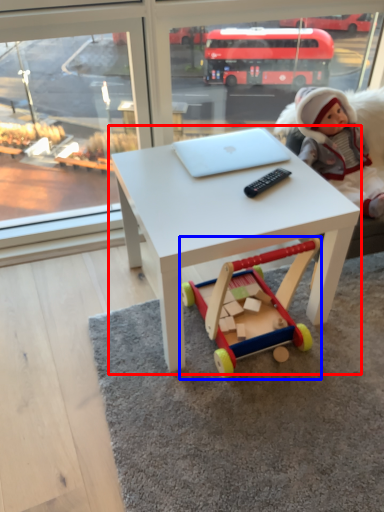
Question: Which point is closer to the camera, table (highlighted by a red box) or toy (highlighted by a blue box)?

Choices:
 (A) table
 (B) toy

Answer: (A)